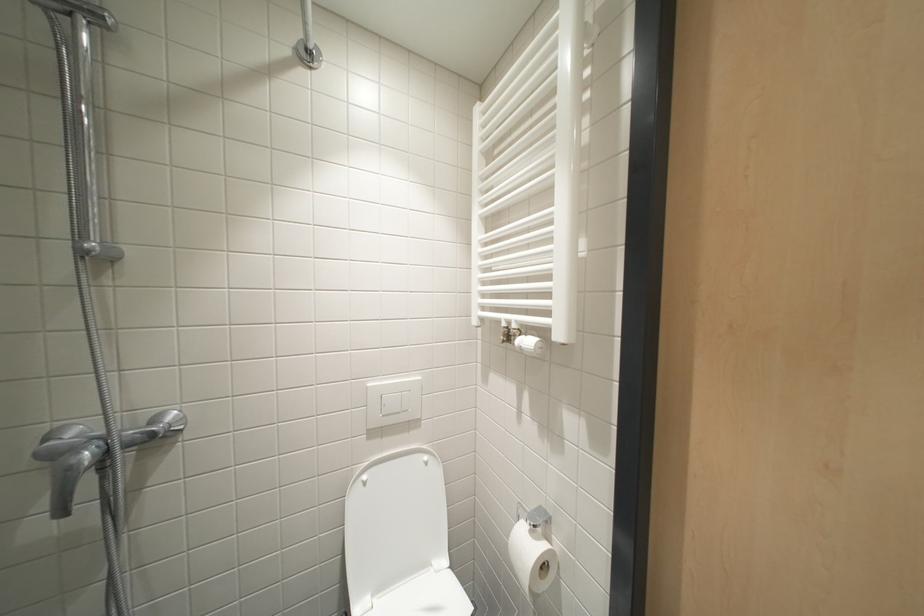
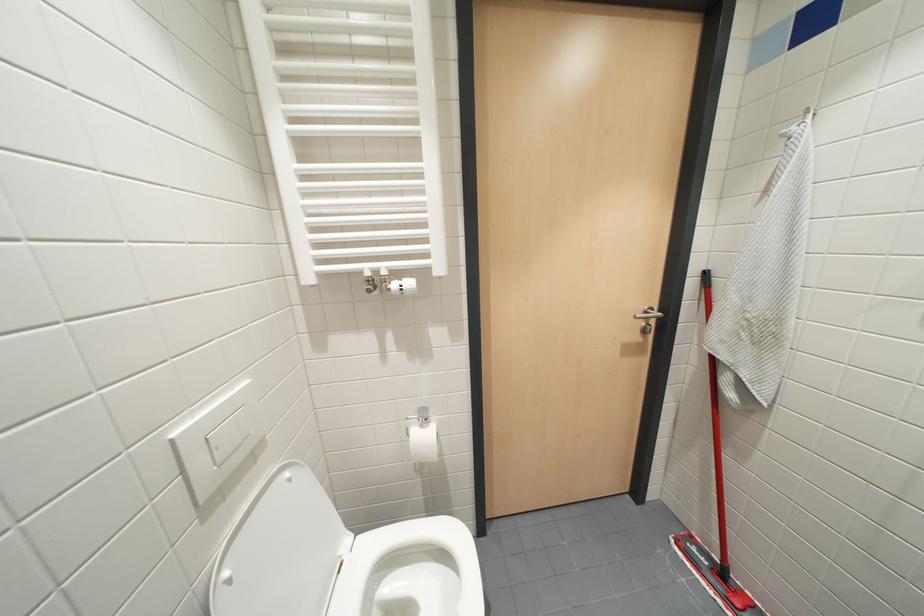
Question: The camera is either moving clockwise (left) or counter-clockwise (right) around the object. The first image is from the beginning of the video and the second image is from the end. Is the camera moving left or right when shooting the video?

Choices:
 (A) Left
 (B) Right

Answer: (A)